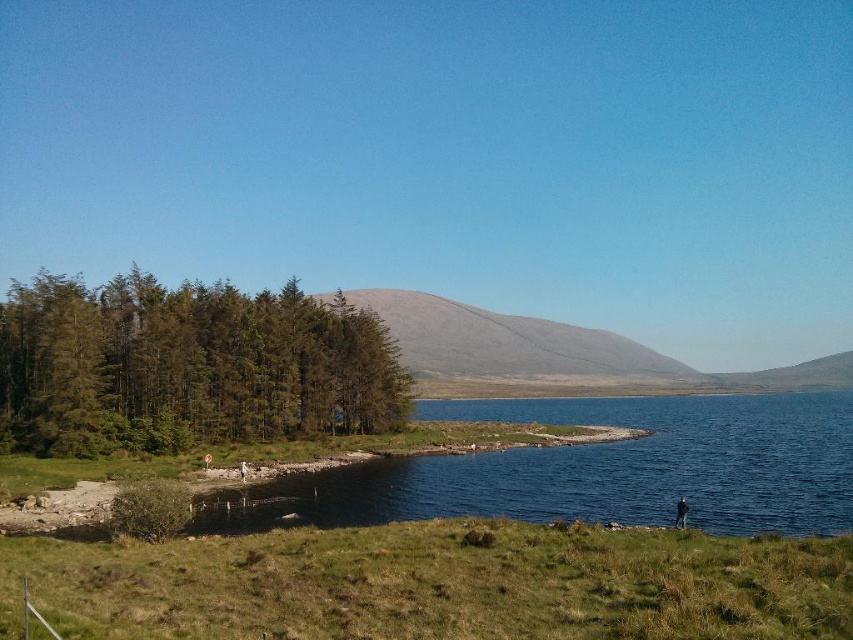
Question: Can you confirm if green grassy at lower center is wider than green textured trees at left?

Choices:
 (A) no
 (B) yes

Answer: (A)

Question: Does green grassy at lower center have a greater width compared to green textured trees at left?

Choices:
 (A) no
 (B) yes

Answer: (A)

Question: Which of the following is the closest to the observer?

Choices:
 (A) (440, 339)
 (B) (4, 566)

Answer: (B)

Question: Which of these objects is positioned closest to the gray matte hillside at center?

Choices:
 (A) green textured trees at left
 (B) green grassy at lower center

Answer: (A)

Question: Is green grassy at lower center positioned at the back of gray matte hillside at center?

Choices:
 (A) yes
 (B) no

Answer: (B)

Question: Which object is positioned closest to the gray matte hillside at center?

Choices:
 (A) green grassy at lower center
 (B) green textured trees at left

Answer: (B)